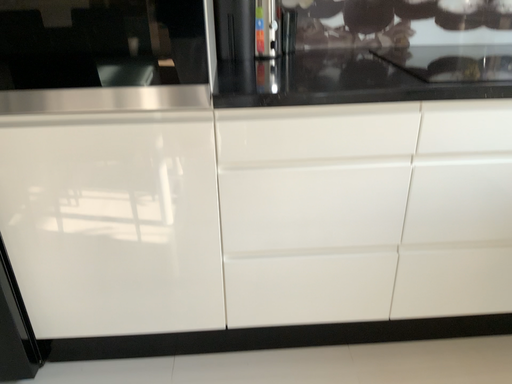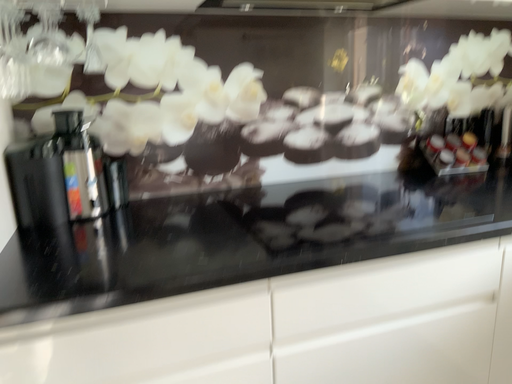
Question: Which way did the camera rotate in the video?

Choices:
 (A) rotated downward
 (B) rotated upward

Answer: (B)